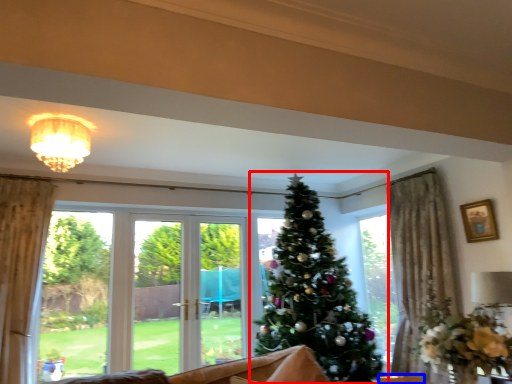
Question: Which point is closer to the camera, christmas tree (highlighted by a red box) or furniture (highlighted by a blue box)?

Choices:
 (A) christmas tree
 (B) furniture

Answer: (B)